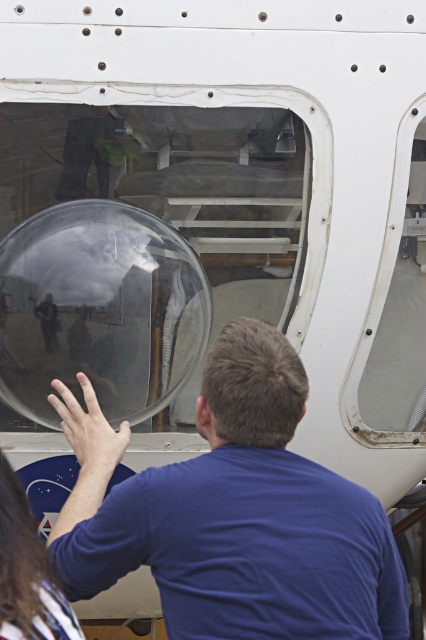
You are a maintenance technician inspecting the aircraft. You notice the transparent glass bubble at center and the long brown hair at lower left in your line of sight. Which object is closer to you?

The transparent glass bubble at center is closer to you than the long brown hair at lower left because it is further to the viewer.

You are standing in front of an aircraft with a transparent dome. There is a point marked at coordinates (x=233, y=513). What object is located at that point?

The blue matte shirt at center is located at point (x=233, y=513).

You are observing a person near an aircraft. You see the blue matte shirt at center and the long brown hair at lower left. Which object is located more to the right side?

The blue matte shirt at center is positioned on the right side of long brown hair at lower left, so the blue matte shirt at center is more to the right.